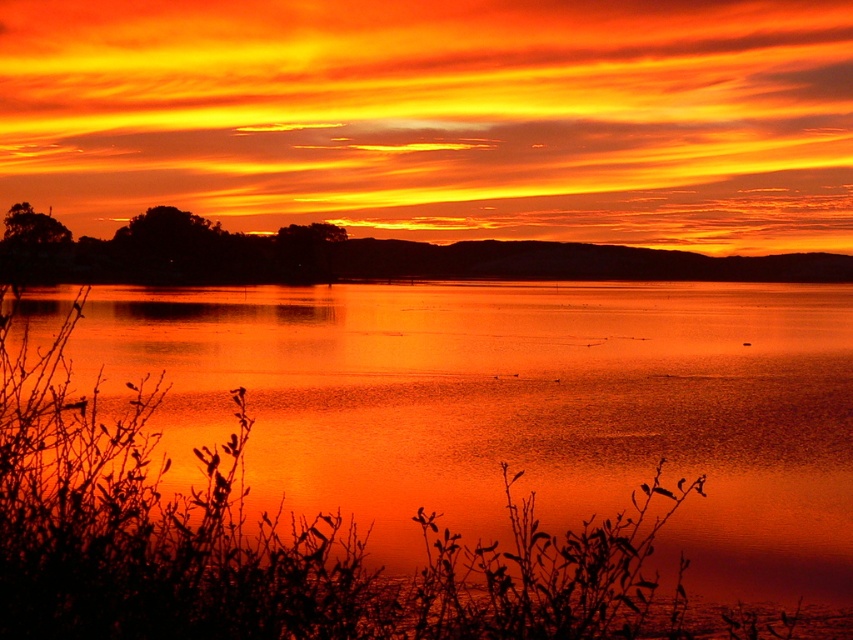
Locate an element on the screen. The width and height of the screenshot is (853, 640). matte orange water at center is located at coordinates (425, 460).

Is point (35, 376) less distant than point (302, 232)?

Yes.

Which is behind, point (776, 634) or point (119, 273)?

Positioned behind is point (119, 273).

Where is `matte orange water at center`? Image resolution: width=853 pixels, height=640 pixels. matte orange water at center is located at coordinates (425, 460).